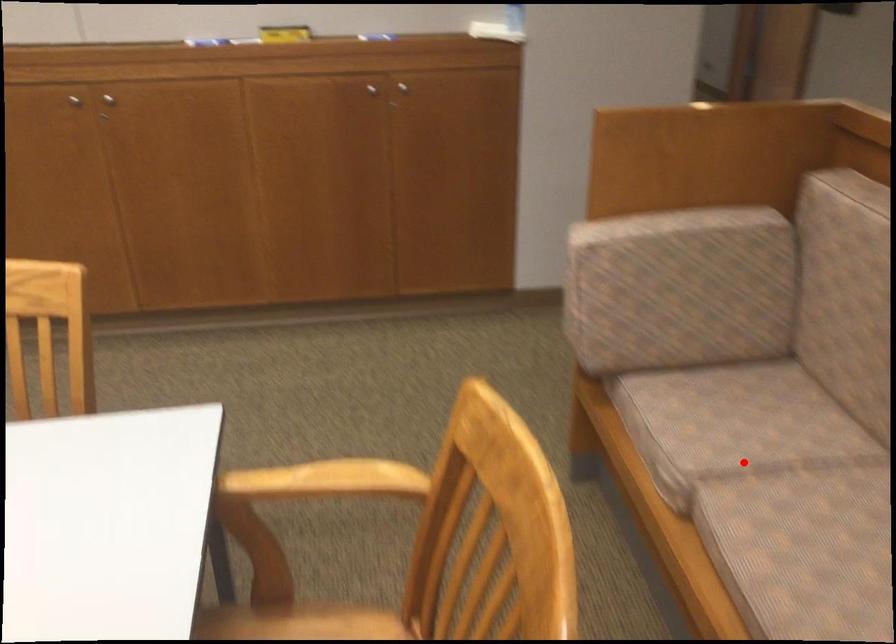
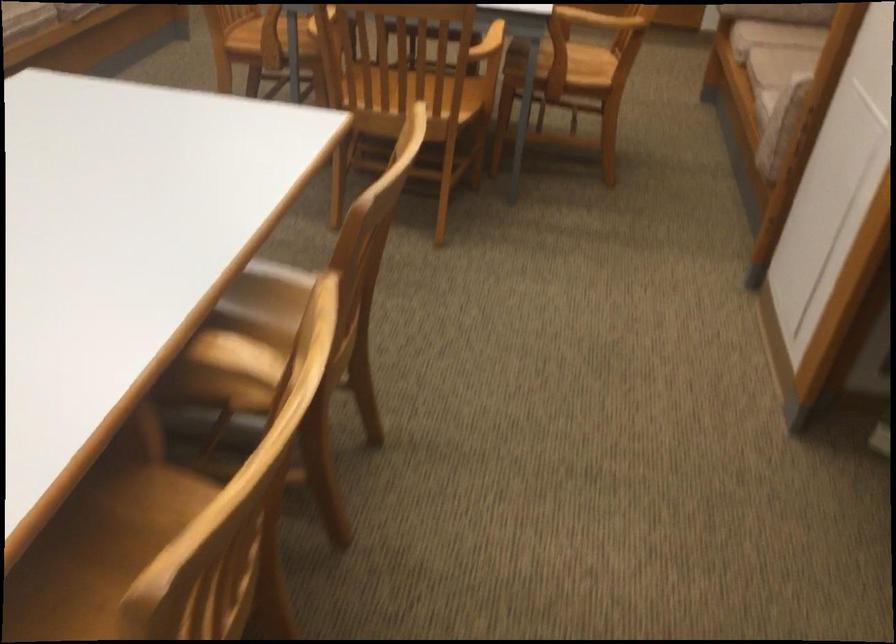
Question: I am providing you with two images of the same scene from different viewpoints. Image1 has a red point marked. In image2, the corresponding 3D location appears at what relative position? Reply with the corresponding letter.

Choices:
 (A) Closer
 (B) Farther

Answer: (B)